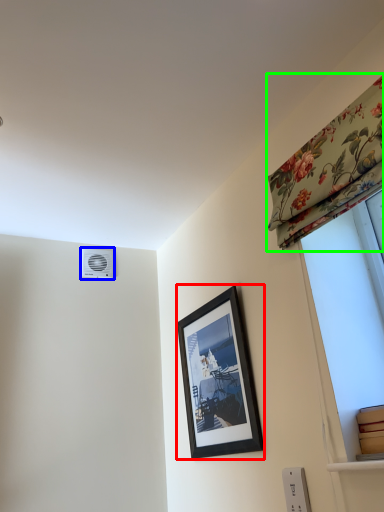
Question: Which is nearer to the picture frame (highlighted by a red box)? air conditioning (highlighted by a blue box) or curtain (highlighted by a green box).

Choices:
 (A) air conditioning
 (B) curtain

Answer: (B)